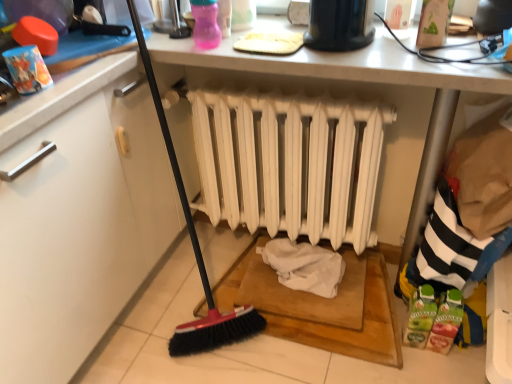
Question: From the image's perspective, is black plastic toaster at upper center under white matte radiator at center?

Choices:
 (A) yes
 (B) no

Answer: (B)

Question: Is black plastic toaster at upper center thinner than white matte radiator at center?

Choices:
 (A) no
 (B) yes

Answer: (A)

Question: From a real-world perspective, is black plastic toaster at upper center on white matte radiator at center?

Choices:
 (A) no
 (B) yes

Answer: (B)

Question: Is black plastic toaster at upper center touching white matte radiator at center?

Choices:
 (A) yes
 (B) no

Answer: (B)

Question: Is the depth of black plastic toaster at upper center greater than that of white matte radiator at center?

Choices:
 (A) no
 (B) yes

Answer: (A)

Question: Considering the relative sizes of black plastic toaster at upper center and white matte radiator at center in the image provided, is black plastic toaster at upper center bigger than white matte radiator at center?

Choices:
 (A) no
 (B) yes

Answer: (A)

Question: Are white matte radiator at center and black plastic toaster at upper center beside each other?

Choices:
 (A) no
 (B) yes

Answer: (A)

Question: Is white matte radiator at center shorter than black plastic toaster at upper center?

Choices:
 (A) yes
 (B) no

Answer: (B)

Question: Is white matte radiator at center looking in the opposite direction of black plastic toaster at upper center?

Choices:
 (A) yes
 (B) no

Answer: (B)

Question: Does white matte radiator at center have a greater width compared to black plastic toaster at upper center?

Choices:
 (A) yes
 (B) no

Answer: (B)

Question: Does white matte radiator at center have a larger size compared to black plastic toaster at upper center?

Choices:
 (A) no
 (B) yes

Answer: (B)

Question: Does white matte radiator at center come in front of black plastic toaster at upper center?

Choices:
 (A) no
 (B) yes

Answer: (A)

Question: From the image's perspective, relative to white matte radiator at center, is black plastic toaster at upper center above or below?

Choices:
 (A) below
 (B) above

Answer: (B)